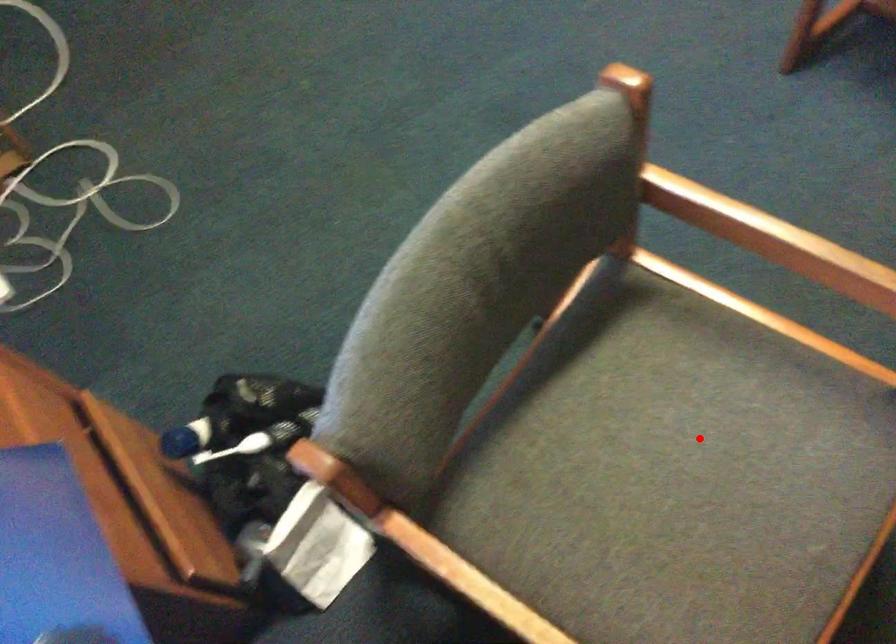
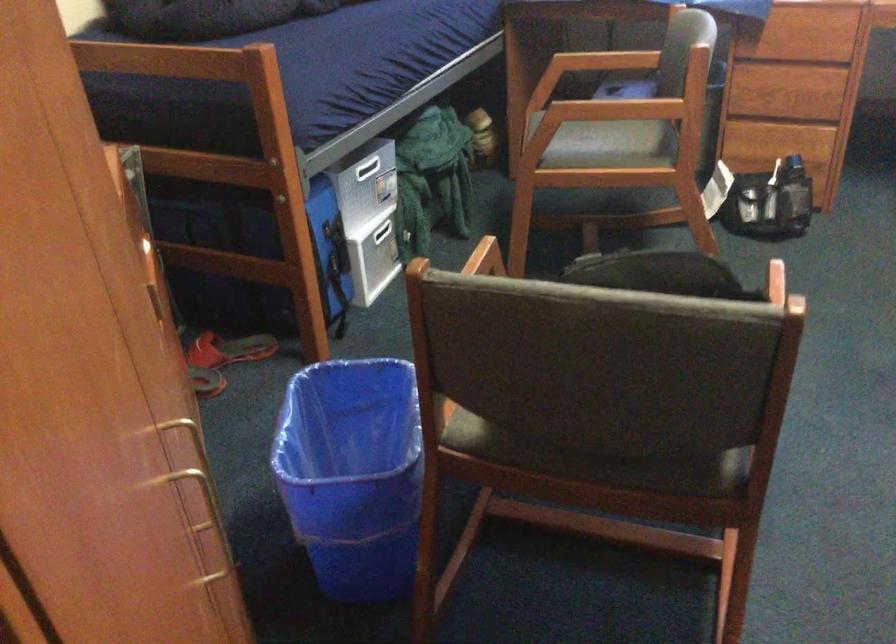
Find the pixel in the second image that matches the highlighted location in the first image.

(605, 145)